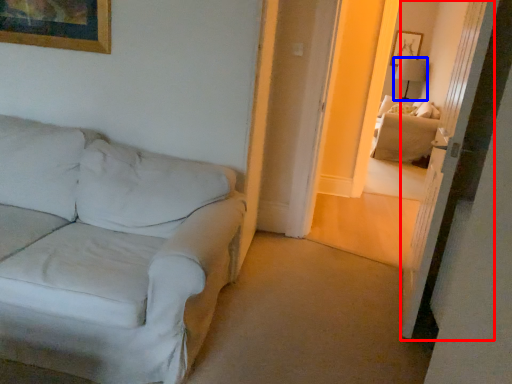
Question: Which object appears farthest to the camera in this image, glass door (highlighted by a red box) or table lamp (highlighted by a blue box)?

Choices:
 (A) glass door
 (B) table lamp

Answer: (B)